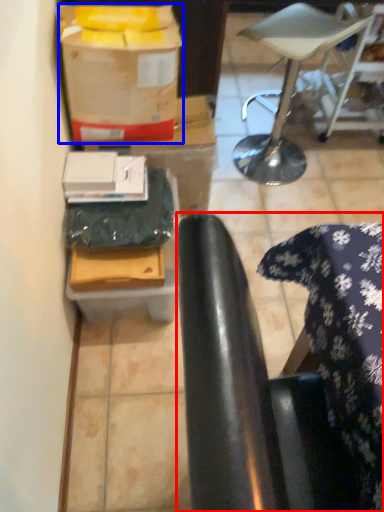
Question: Which of the following is the closest to the observer, chair (highlighted by a red box) or wrapping paper (highlighted by a blue box)?

Choices:
 (A) chair
 (B) wrapping paper

Answer: (A)